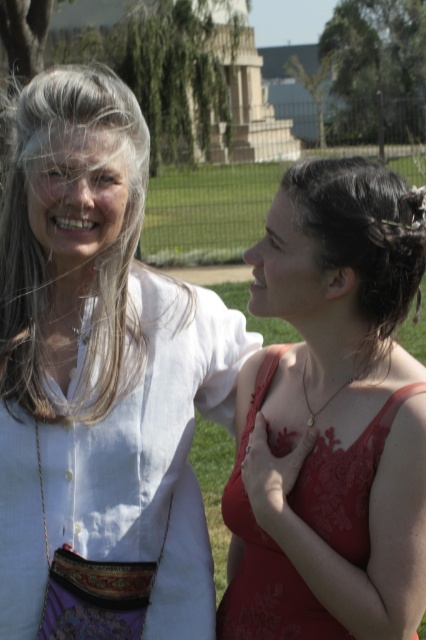
You are standing at the point marked as point (100, 381) in the image. Which object is directly in front of you?

The white cotton shirt at upper left is directly in front of you at point (100, 381).

You are standing in a park and see two people in front of you. One is wearing a white cotton shirt at upper left and the other is wearing a sleeveless red dress at lower right. If you want to greet them both, which person should you approach first to reach the closest one?

The white cotton shirt at upper left is 4.61 meters away from the viewer, so you should approach the person wearing the white cotton shirt at upper left first since they are closer than the other person.